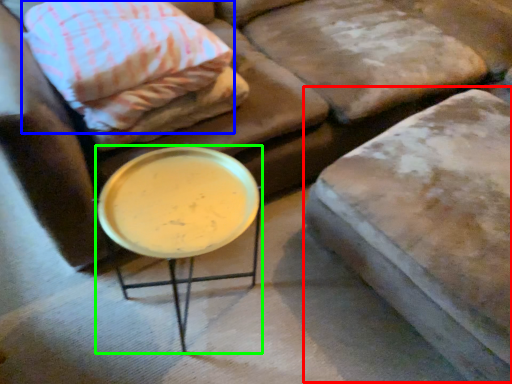
Question: Based on their relative distances, which object is farther from swivel chair (highlighted by a red box)? Choose from pillow (highlighted by a blue box) and table (highlighted by a green box).

Choices:
 (A) pillow
 (B) table

Answer: (A)